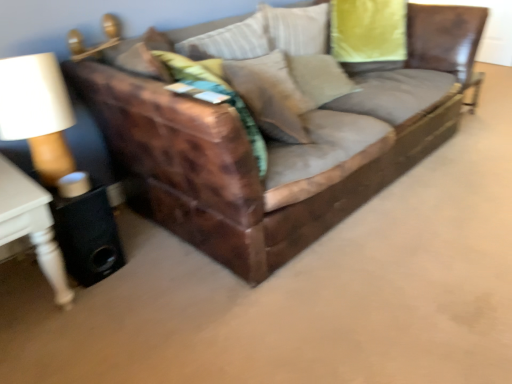
Question: Does suede-like beige pillow at center lie in front of leather couch at center?

Choices:
 (A) no
 (B) yes

Answer: (A)

Question: Is suede-like beige pillow at center further to the viewer compared to leather couch at center?

Choices:
 (A) yes
 (B) no

Answer: (A)

Question: Is suede-like beige pillow at center far from leather couch at center?

Choices:
 (A) no
 (B) yes

Answer: (A)

Question: Is suede-like beige pillow at center looking in the opposite direction of leather couch at center?

Choices:
 (A) no
 (B) yes

Answer: (B)

Question: Is suede-like beige pillow at center taller than leather couch at center?

Choices:
 (A) no
 (B) yes

Answer: (A)

Question: Considering the positions of leather couch at center and white wood side table at left in the image, is leather couch at center taller or shorter than white wood side table at left?

Choices:
 (A) short
 (B) tall

Answer: (B)

Question: Is leather couch at center bigger or smaller than white wood side table at left?

Choices:
 (A) small
 (B) big

Answer: (B)

Question: From the image's perspective, is leather couch at center positioned above or below white wood side table at left?

Choices:
 (A) above
 (B) below

Answer: (A)

Question: Does point (140, 180) appear closer or farther from the camera than point (28, 183)?

Choices:
 (A) closer
 (B) farther

Answer: (B)

Question: Considering the positions of leather couch at center and suede-like beige pillow at center in the image, is leather couch at center bigger or smaller than suede-like beige pillow at center?

Choices:
 (A) small
 (B) big

Answer: (B)

Question: Looking at their shapes, would you say leather couch at center is wider or thinner than suede-like beige pillow at center?

Choices:
 (A) wide
 (B) thin

Answer: (A)

Question: Is leather couch at center inside the boundaries of suede-like beige pillow at center, or outside?

Choices:
 (A) inside
 (B) outside

Answer: (B)

Question: In the image, is leather couch at center positioned in front of or behind suede-like beige pillow at center?

Choices:
 (A) behind
 (B) front

Answer: (B)

Question: Looking at their shapes, would you say suede-like beige pillow at center is wider or thinner than white wood side table at left?

Choices:
 (A) thin
 (B) wide

Answer: (A)

Question: From the image's perspective, is suede-like beige pillow at center above or below white wood side table at left?

Choices:
 (A) above
 (B) below

Answer: (A)